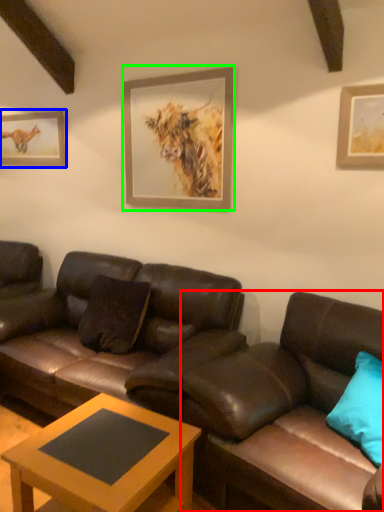
Question: Which object is the closest to the studio couch (highlighted by a red box)? Choose among these: picture frame (highlighted by a blue box) or picture frame (highlighted by a green box).

Choices:
 (A) picture frame
 (B) picture frame

Answer: (B)